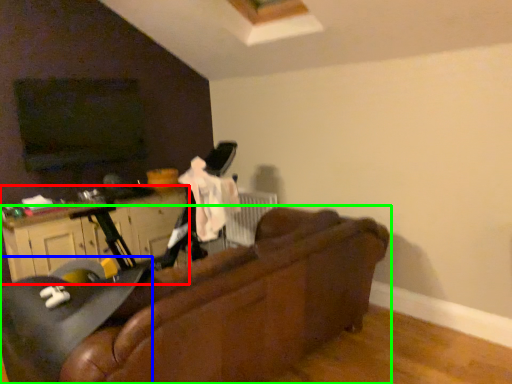
Question: Estimate the real-world distances between objects in this image. Which object is closer to dresser (highlighted by a red box), swivel chair (highlighted by a blue box) or studio couch (highlighted by a green box)?

Choices:
 (A) swivel chair
 (B) studio couch

Answer: (A)